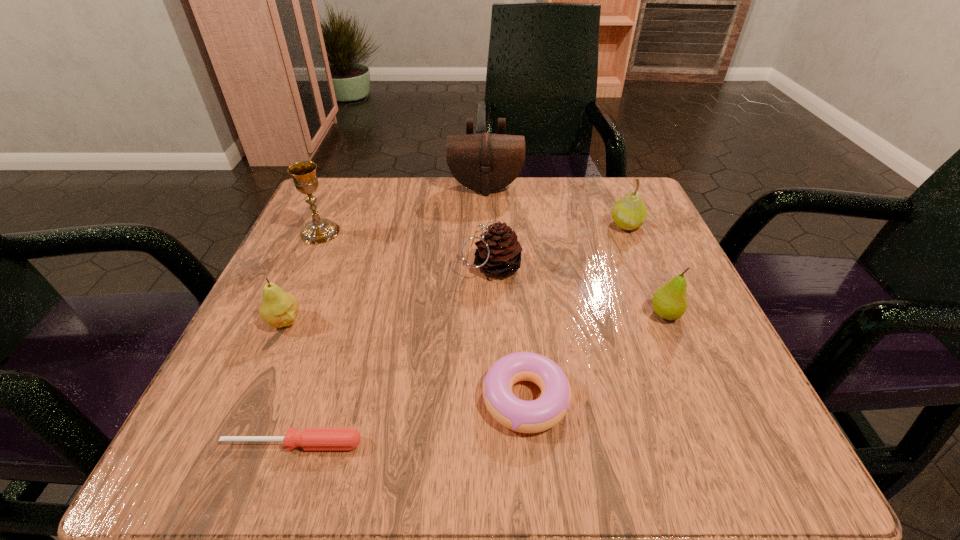
In order to click on the farthest object in this screenshot , I will do `click(485, 162)`.

At what (x,y) coordinates should I click in order to perform the action: click on chalice. Please return your answer as a coordinate pair (x, y). The image size is (960, 540). Looking at the image, I should click on (319, 230).

Locate an element on the screen. the farthest pear is located at coordinates (629, 213).

This screenshot has height=540, width=960. Identify the location of the fourth farthest object. (499, 252).

This screenshot has width=960, height=540. In order to click on the leftmost pear in this screenshot , I will do `click(278, 308)`.

Identify the location of the second shortest object. (545, 412).

Identify the location of the shortest object. Image resolution: width=960 pixels, height=540 pixels. (311, 438).

Find the location of `vacant space located 0.380m with the flap open on the pouch`. vacant space located 0.380m with the flap open on the pouch is located at coordinates (488, 327).

This screenshot has height=540, width=960. In order to click on free space located on the front of the chalice in this screenshot , I will do `click(274, 335)`.

At what (x,y) coordinates should I click in order to perform the action: click on vacant area situated on the back of the farthest pear. Please return your answer as a coordinate pair (x, y). Looking at the image, I should click on (609, 183).